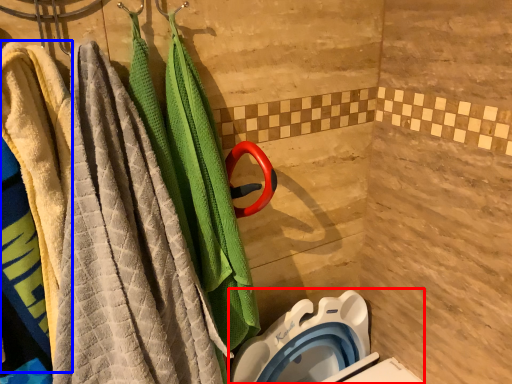
Question: Which object appears farthest to the camera in this image, toilet bowl (highlighted by a red box) or beach towel (highlighted by a blue box)?

Choices:
 (A) toilet bowl
 (B) beach towel

Answer: (A)